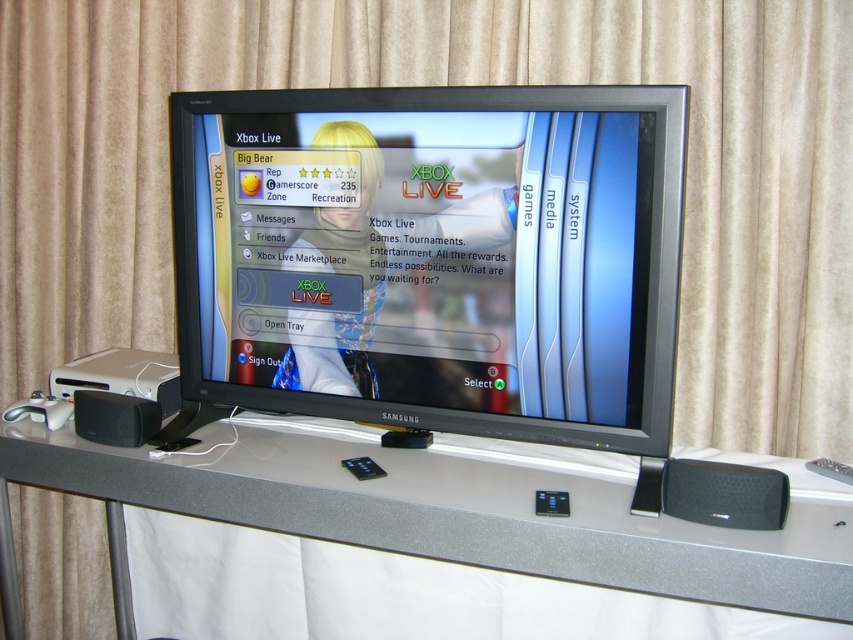
You are sitting on the couch in front of the TV and want to reach the remote control. The remote is either at point (741, 515) or point (108, 406). Which point is closer to you?

Point (741, 515) is in front of point (108, 406), so the remote at point (741, 515) is closer to you.

You are setting up a home theater system and need to place a new DVD player. You have the white glossy table at center and the black plastic speaker at lower left. Which surface should you place the DVD player on to keep it closer to the speaker?

The white glossy table at center is to the right of the black plastic speaker at lower left, so placing the DVD player on the white glossy table at center would keep it closer to the speaker.

You have a small decorative item that is 2 inches tall. You want to place it on the white glossy table at center so it can be seen from above. Will the black plastic speaker at lower left block the view of the decorative item from above?

The white glossy table at center has a greater height compared to the black plastic speaker at lower left. Since the table is taller, placing the decorative item on it will keep it above the speaker, so the speaker won